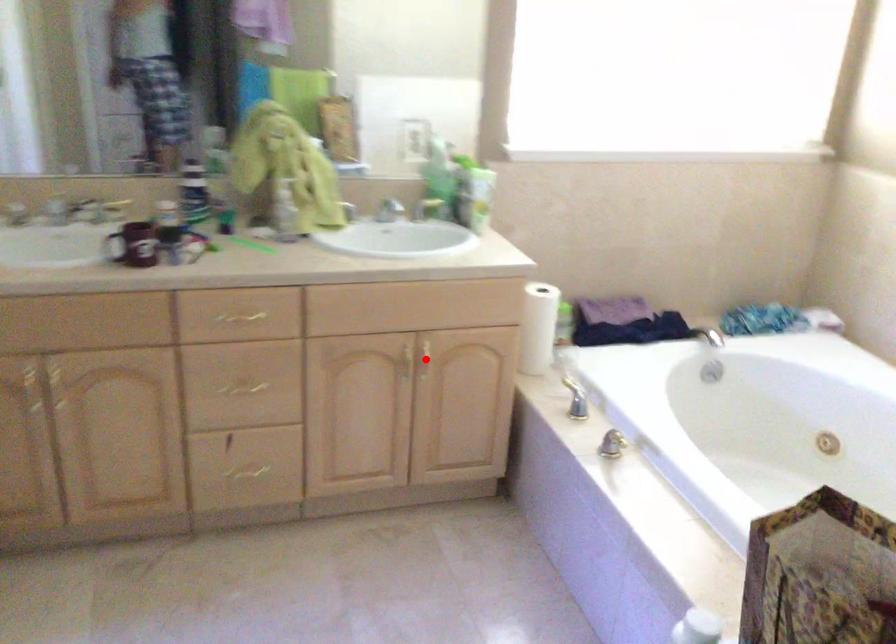
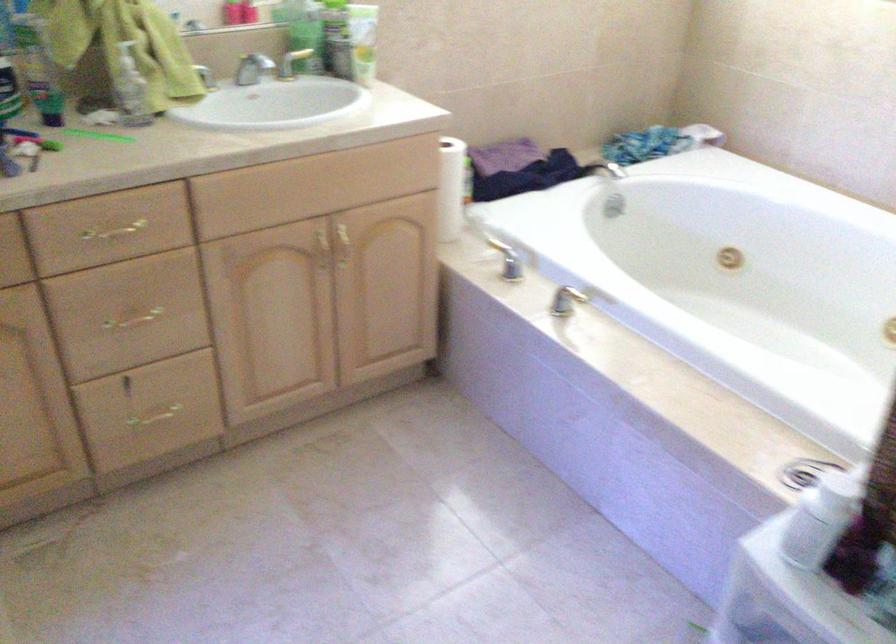
Question: I am providing you with two images of the same scene from different viewpoints. Given a red point in image1, look at the same physical point in image2. Is it:

Choices:
 (A) Closer to the viewpoint
 (B) Farther from the viewpoint

Answer: (A)